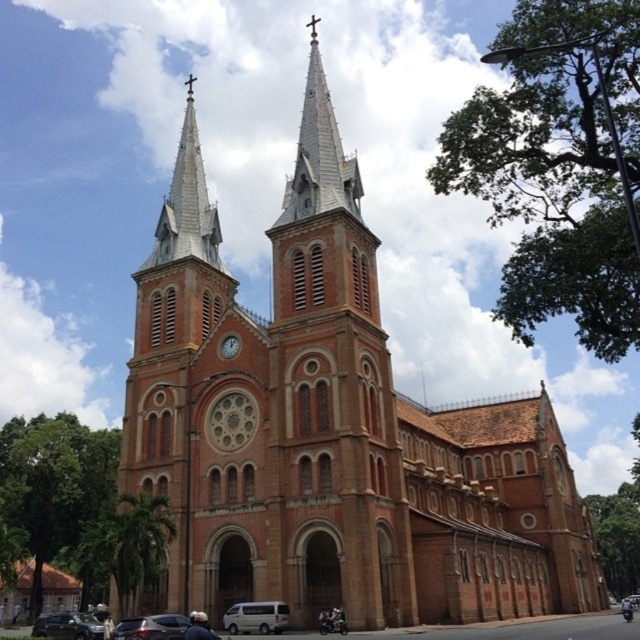
Which of these two, silver shingled spire at center or white matte van at center, stands taller?

With more height is silver shingled spire at center.

Is point (332, 156) farther from viewer compared to point (230, 632)?

That is True.

Is point (314, 92) behind point (257, 616)?

Yes.

You are a GUI agent. You are given a task and a screenshot of the screen. Output one action in this format:
    pyautogui.click(x=<x>, y=<y>)
    Task: Click on the silver shingled spire at center
    The height and width of the screenshot is (640, 640).
    Given the screenshot: What is the action you would take?
    pyautogui.click(x=320, y=154)

Can you confirm if white matte van at center is positioned below metallic silver car at lower left?

No.

Does white matte van at center have a lesser width compared to metallic silver car at lower left?

Correct, white matte van at center's width is less than metallic silver car at lower left's.

Does point (228, 630) come closer to viewer compared to point (172, 637)?

No.

I want to click on white matte van at center, so click(x=257, y=618).

Can you confirm if silver shingled spire at center is thinner than metallic silver car at lower left?

In fact, silver shingled spire at center might be wider than metallic silver car at lower left.

Between silver shingled spire at center and metallic silver car at lower left, which one is positioned higher?

Positioned higher is silver shingled spire at center.

Image resolution: width=640 pixels, height=640 pixels. I want to click on silver shingled spire at center, so click(320, 154).